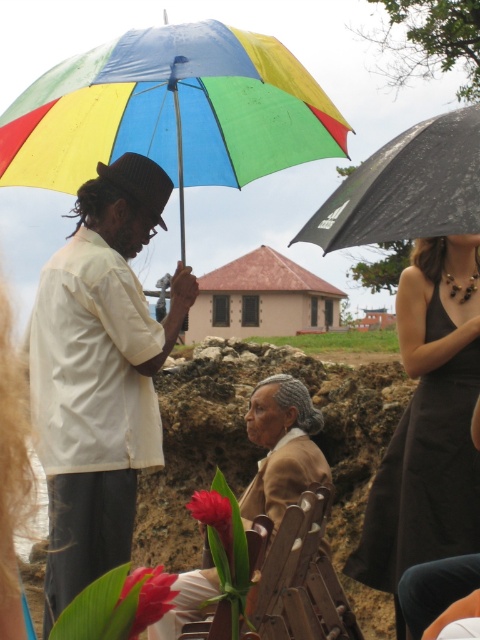
Who is more forward, (44, 592) or (169, 124)?

Point (44, 592) is in front.

Describe the element at coordinates (99, 372) in the screenshot. I see `white matte shirt at center` at that location.

Between point (110, 387) and point (323, 115), which one is positioned in front?

Point (110, 387)

Locate an element on the screen. The width and height of the screenshot is (480, 640). white matte shirt at center is located at coordinates (99, 372).

Looking at this image, between rainbow fabric umbrella at upper left and black matte umbrella at upper right, which one has less height?

Standing shorter between the two is black matte umbrella at upper right.

Is rainbow fabric umbrella at upper left to the left of black matte umbrella at upper right from the viewer's perspective?

Correct, you'll find rainbow fabric umbrella at upper left to the left of black matte umbrella at upper right.

Is point (214, 152) positioned in front of point (303, 227)?

No.

Identify the location of rainbow fabric umbrella at upper left. The height and width of the screenshot is (640, 480). (171, 112).

Is point (51, 387) positioned before point (435, 422)?

Yes, point (51, 387) is closer to viewer.

Who is higher up, white matte shirt at center or black satin dress at center?

Positioned higher is white matte shirt at center.

Is point (106, 412) behind point (437, 362)?

No, (106, 412) is in front of (437, 362).

The height and width of the screenshot is (640, 480). I want to click on white matte shirt at center, so click(99, 372).